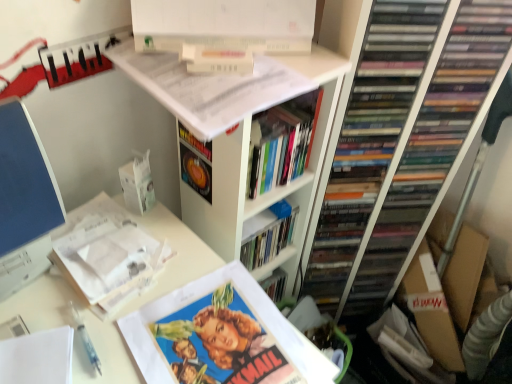
This screenshot has width=512, height=384. I want to click on vacant space in front of white paper at upper left, positioned as the 2th book in bottom-to-top order, so click(x=73, y=320).